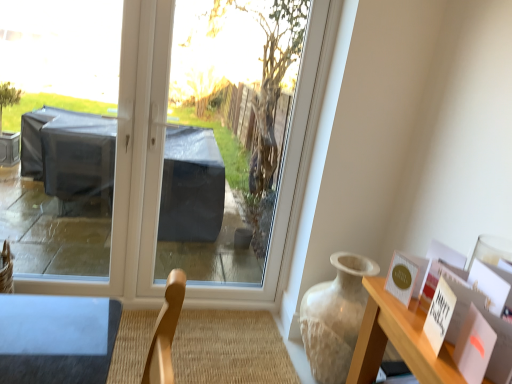
This screenshot has width=512, height=384. What are the coordinates of `transparent plastic window screen at center` in the screenshot? It's located at (229, 137).

The image size is (512, 384). In order to click on matte gold postcard at upper right in this screenshot , I will do coord(401,278).

Is transparent plastic window screen at center touching transparent plastic at center?

No.

In the scene shown: Could you tell me if transparent plastic window screen at center is turned towards transparent plastic at center?

Yes, transparent plastic window screen at center is facing transparent plastic at center.

Which is more to the right, transparent plastic window screen at center or transparent plastic at center?

Positioned to the right is transparent plastic window screen at center.

From a real-world perspective, is transparent plastic window screen at center located beneath transparent plastic at center?

Incorrect, from a real-world perspective, transparent plastic window screen at center is higher than transparent plastic at center.

Is point (400, 257) closer to viewer compared to point (172, 16)?

Yes, point (400, 257) is in front of point (172, 16).

Consider the image. Which of these two, matte gold postcard at upper right or transparent plastic at center, stands shorter?

Standing shorter between the two is matte gold postcard at upper right.

From the image's perspective, is matte gold postcard at upper right on top of transparent plastic at center?

Incorrect, from the image's perspective, matte gold postcard at upper right is lower than transparent plastic at center.

Could you tell me if matte gold postcard at upper right is turned towards transparent plastic at center?

No, matte gold postcard at upper right is not facing towards transparent plastic at center.

From the image's perspective, is matte gold postcard at upper right beneath matte beige vase at right?

Actually, matte gold postcard at upper right appears above matte beige vase at right in the image.

This screenshot has width=512, height=384. I want to click on postcard above the matte beige vase at right (from the image's perspective), so click(401, 278).

Considering the relative sizes of matte gold postcard at upper right and matte beige vase at right in the image provided, is matte gold postcard at upper right taller than matte beige vase at right?

No, matte gold postcard at upper right is not taller than matte beige vase at right.

Does matte gold postcard at upper right have a larger size compared to matte beige vase at right?

Incorrect, matte gold postcard at upper right is not larger than matte beige vase at right.

Based on the photo, from a real-world perspective, is matte beige vase at right positioned under transparent plastic at center based on gravity?

Yes, from a real-world perspective, matte beige vase at right is under transparent plastic at center.

Locate an element on the screen. The width and height of the screenshot is (512, 384). window lying behind the matte beige vase at right is located at coordinates (133, 160).

Which of these two, matte beige vase at right or transparent plastic at center, is thinner?

transparent plastic at center is thinner.

Is matte beige vase at right in front of matte gold postcard at upper right?

No.

From the image's perspective, who appears lower, matte beige vase at right or matte gold postcard at upper right?

matte beige vase at right appears lower in the image.

From a real-world perspective, who is located higher, matte beige vase at right or matte gold postcard at upper right?

From a 3D spatial view, matte gold postcard at upper right is above.

Who is taller, matte beige vase at right or matte gold postcard at upper right?

Standing taller between the two is matte beige vase at right.

Is transparent plastic window screen at center bigger or smaller than matte gold postcard at upper right?

In the image, transparent plastic window screen at center appears to be larger than matte gold postcard at upper right.

Is point (267, 202) closer or farther from the camera than point (409, 293)?

Clearly, point (267, 202) is more distant from the camera than point (409, 293).

Is transparent plastic window screen at center at the right side of matte gold postcard at upper right?

In fact, transparent plastic window screen at center is to the left of matte gold postcard at upper right.

From the image's perspective, which is above, transparent plastic window screen at center or matte gold postcard at upper right?

transparent plastic window screen at center, from the image's perspective.

What's the angular difference between matte gold postcard at upper right and transparent plastic window screen at center's facing directions?

The angular difference between matte gold postcard at upper right and transparent plastic window screen at center is 74.9 degrees.

From the image's perspective, is matte gold postcard at upper right below transparent plastic window screen at center?

Yes.

Would you say matte gold postcard at upper right contains transparent plastic window screen at center?

No, transparent plastic window screen at center is not inside matte gold postcard at upper right.

Does matte gold postcard at upper right have a lesser height compared to transparent plastic window screen at center?

Yes.

You are a GUI agent. You are given a task and a screenshot of the screen. Output one action in this format:
    pyautogui.click(x=<x>, y=<y>)
    Task: Click on the window screen on the right of transparent plastic at center
    This screenshot has width=512, height=384.
    Given the screenshot: What is the action you would take?
    pyautogui.click(x=229, y=137)

Find the location of a particular element. window above the matte gold postcard at upper right (from a real-world perspective) is located at coordinates (133, 160).

Looking at the image, which one is located closer to transparent plastic at center, transparent plastic window screen at center or matte gold postcard at upper right?

matte gold postcard at upper right is closer to transparent plastic at center.

Estimate the real-world distances between objects in this image. Which object is closer to matte beige vase at right, transparent plastic window screen at center or matte gold postcard at upper right?

matte gold postcard at upper right is closer to matte beige vase at right.

In the scene shown: Which object lies nearer to the anchor point matte gold postcard at upper right, transparent plastic at center or transparent plastic window screen at center?

transparent plastic at center lies closer to matte gold postcard at upper right than the other object.

When comparing their distances from matte beige vase at right, does transparent plastic window screen at center or transparent plastic at center seem closer?

Among the two, transparent plastic at center is located nearer to matte beige vase at right.

When comparing their distances from matte gold postcard at upper right, does transparent plastic window screen at center or matte beige vase at right seem further?

transparent plastic window screen at center lies further to matte gold postcard at upper right than the other object.

Which object lies further to the anchor point transparent plastic window screen at center, transparent plastic at center or matte gold postcard at upper right?

Based on the image, matte gold postcard at upper right appears to be further to transparent plastic window screen at center.

When comparing their distances from transparent plastic window screen at center, does matte gold postcard at upper right or transparent plastic at center seem further?

matte gold postcard at upper right is positioned further to the anchor transparent plastic window screen at center.

When comparing their distances from transparent plastic at center, does matte beige vase at right or matte gold postcard at upper right seem further?

matte gold postcard at upper right is positioned further to the anchor transparent plastic at center.

The height and width of the screenshot is (384, 512). I want to click on window screen between transparent plastic at center and matte gold postcard at upper right from left to right, so click(229, 137).

The width and height of the screenshot is (512, 384). What are the coordinates of `vase situated between transparent plastic at center and matte gold postcard at upper right from left to right` in the screenshot? It's located at (335, 317).

I want to click on window screen between transparent plastic at center and matte beige vase at right from left to right, so click(x=229, y=137).

Image resolution: width=512 pixels, height=384 pixels. Identify the location of postcard between transparent plastic window screen at center and matte beige vase at right from top to bottom. (401, 278).